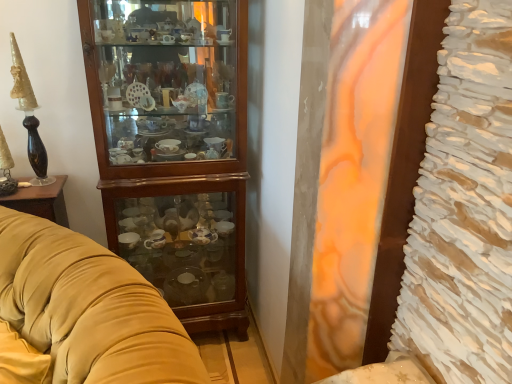
Question: Considering the relative sizes of velvet yellow couch at left and wooden cabinet at left in the image provided, is velvet yellow couch at left wider than wooden cabinet at left?

Choices:
 (A) no
 (B) yes

Answer: (B)

Question: Could you tell me if velvet yellow couch at left is facing wooden cabinet at left?

Choices:
 (A) no
 (B) yes

Answer: (A)

Question: Does velvet yellow couch at left have a smaller size compared to wooden cabinet at left?

Choices:
 (A) no
 (B) yes

Answer: (A)

Question: Is velvet yellow couch at left to the right of wooden cabinet at left from the viewer's perspective?

Choices:
 (A) no
 (B) yes

Answer: (A)

Question: Is velvet yellow couch at left at the left side of wooden cabinet at left?

Choices:
 (A) yes
 (B) no

Answer: (A)

Question: Are velvet yellow couch at left and wooden cabinet at left located far from each other?

Choices:
 (A) yes
 (B) no

Answer: (B)

Question: Can you confirm if wooden cabinet at left is positioned to the right of velvet yellow couch at left?

Choices:
 (A) yes
 (B) no

Answer: (A)

Question: Is wooden cabinet at left shorter than velvet yellow couch at left?

Choices:
 (A) no
 (B) yes

Answer: (A)

Question: Considering the relative sizes of wooden cabinet at left and velvet yellow couch at left in the image provided, is wooden cabinet at left smaller than velvet yellow couch at left?

Choices:
 (A) no
 (B) yes

Answer: (B)

Question: Does wooden cabinet at left have a larger size compared to velvet yellow couch at left?

Choices:
 (A) no
 (B) yes

Answer: (A)

Question: Is wooden cabinet at left taller than velvet yellow couch at left?

Choices:
 (A) yes
 (B) no

Answer: (A)

Question: Could velvet yellow couch at left be considered to be inside wooden cabinet at left?

Choices:
 (A) no
 (B) yes

Answer: (A)

Question: Relative to wooden cabinet at left, is velvet yellow couch at left in front or behind?

Choices:
 (A) front
 (B) behind

Answer: (A)